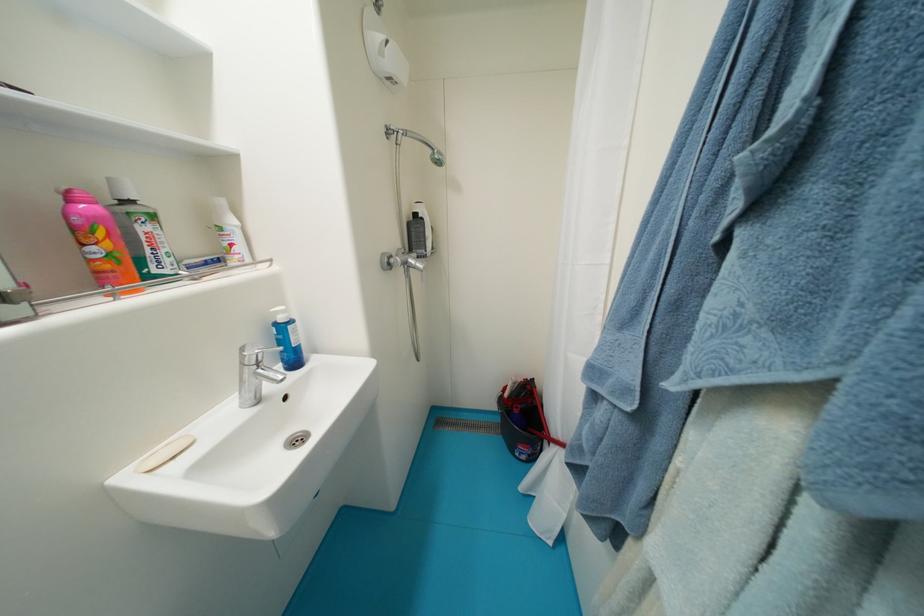
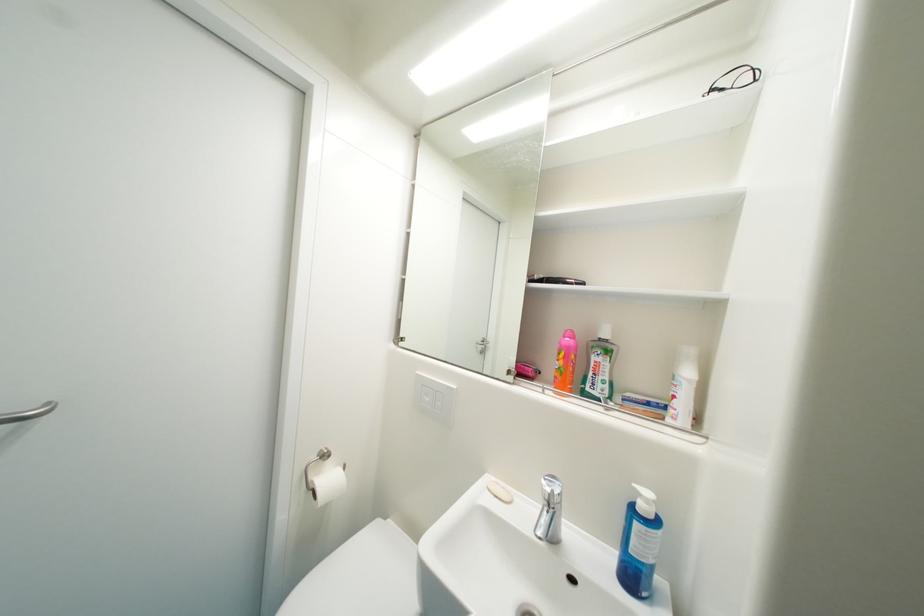
The point at (124, 256) is marked in the first image. Where is the corresponding point in the second image?

(569, 371)